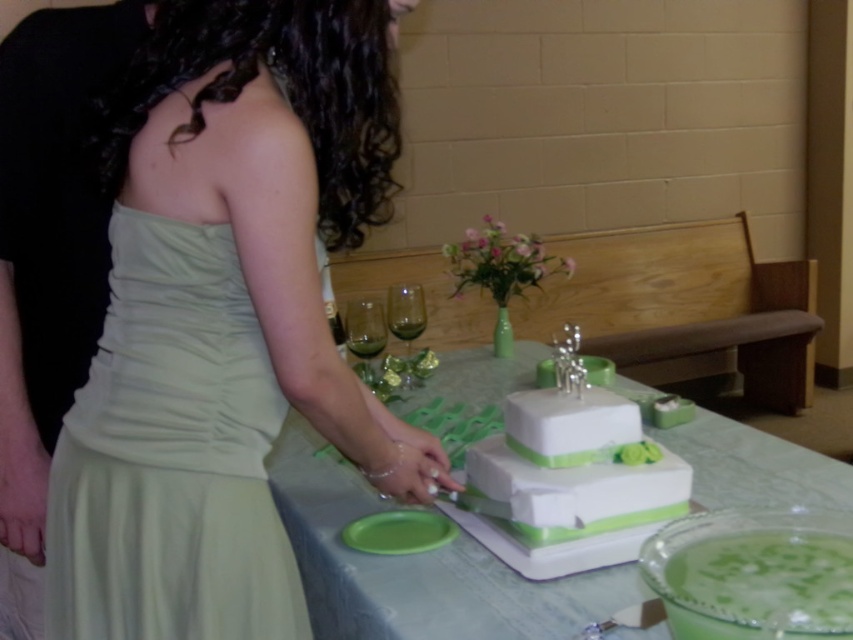
Question: Which point is closer to the camera taking this photo?

Choices:
 (A) (386, 534)
 (B) (405, 328)

Answer: (A)

Question: Does white matte wedding cake at center have a lesser width compared to green matte platter at lower center?

Choices:
 (A) yes
 (B) no

Answer: (B)

Question: Among these points, which one is nearest to the camera?

Choices:
 (A) (842, 605)
 (B) (157, 307)
 (C) (381, 323)
 (D) (312, 180)

Answer: (A)

Question: Is white matte wedding cake at center closer to the viewer compared to green matte platter at lower center?

Choices:
 (A) yes
 (B) no

Answer: (A)

Question: Is satin dress at center further to camera compared to transparent glass at center?

Choices:
 (A) yes
 (B) no

Answer: (B)

Question: Based on their relative distances, which object is nearer to the translucent glass wine at center?

Choices:
 (A) translucent glass at table center
 (B) green frosted cake at center
 (C) transparent glass at center
 (D) satin light green dress at center

Answer: (A)